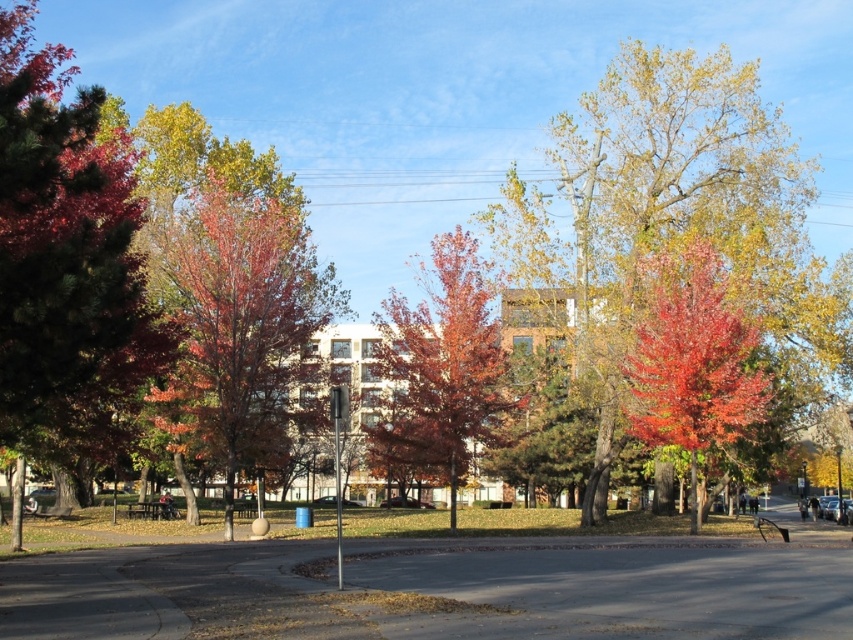
Question: Does shiny red leaves at left have a greater width compared to reddish-brown bark tree at center?

Choices:
 (A) yes
 (B) no

Answer: (B)

Question: Which object appears closest to the camera in this image?

Choices:
 (A) matte red tree at center
 (B) reddish-brown bark tree at center

Answer: (B)

Question: Is matte red tree at center wider than shiny red leaves at center?

Choices:
 (A) no
 (B) yes

Answer: (B)

Question: Which of the following is the farthest from the observer?

Choices:
 (A) shiny red leaves at center
 (B) reddish-brown bark tree at center

Answer: (A)

Question: Based on their relative distances, which object is farther from the shiny red leaves at left?

Choices:
 (A) reddish-brown bark tree at center
 (B) autumn leaves at center
 (C) matte red tree at center

Answer: (B)

Question: Can you confirm if autumn leaves at center is smaller than shiny red leaves at center?

Choices:
 (A) no
 (B) yes

Answer: (A)